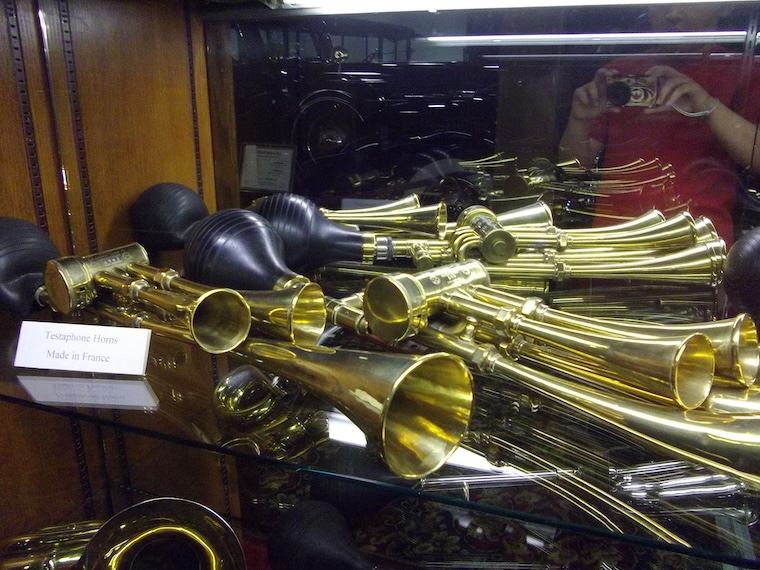
You are a GUI agent. You are given a task and a screenshot of the screen. Output one action in this format:
    pyautogui.click(x=<x>, y=<y>)
    Task: Click on the wall
    
    Given the screenshot: What is the action you would take?
    (x=137, y=115)